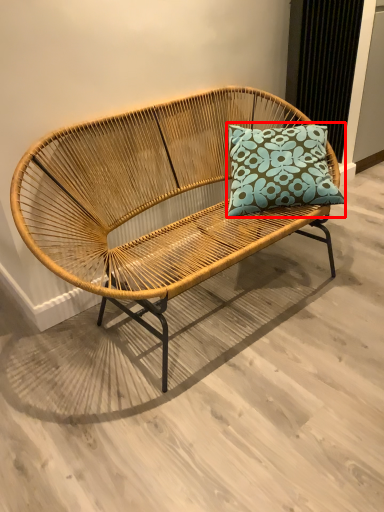
Question: In this image, where is pillow (annotated by the red box) located relative to studio couch?

Choices:
 (A) right
 (B) left

Answer: (A)